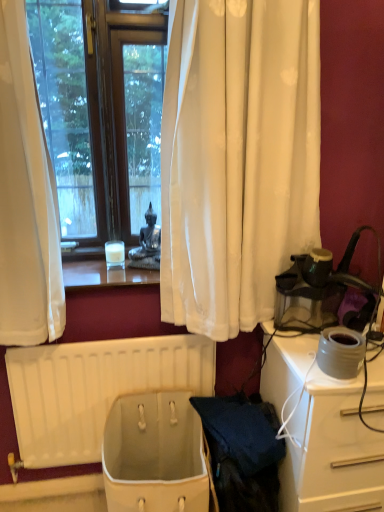
Question: Is matte gray pot at right shorter than white glossy desk at right?

Choices:
 (A) yes
 (B) no

Answer: (A)

Question: From a real-world perspective, does matte gray pot at right stand above white glossy desk at right?

Choices:
 (A) no
 (B) yes

Answer: (B)

Question: Does matte gray pot at right have a greater width compared to white glossy desk at right?

Choices:
 (A) yes
 (B) no

Answer: (B)

Question: Is matte gray pot at right further to camera compared to white glossy desk at right?

Choices:
 (A) no
 (B) yes

Answer: (B)

Question: Considering the relative sizes of matte gray pot at right and white glossy desk at right in the image provided, is matte gray pot at right taller than white glossy desk at right?

Choices:
 (A) yes
 (B) no

Answer: (B)

Question: Is translucent glass candle at center inside or outside of white fabric basket at lower center?

Choices:
 (A) inside
 (B) outside

Answer: (B)

Question: Is translucent glass candle at center taller or shorter than white fabric basket at lower center?

Choices:
 (A) tall
 (B) short

Answer: (B)

Question: In the image, is translucent glass candle at center positioned in front of or behind white fabric basket at lower center?

Choices:
 (A) behind
 (B) front

Answer: (A)

Question: Is translucent glass candle at center bigger or smaller than white fabric basket at lower center?

Choices:
 (A) small
 (B) big

Answer: (A)

Question: Considering the relative positions of white plastic radiator at lower center and translucent glass candle at center in the image provided, is white plastic radiator at lower center to the left or to the right of translucent glass candle at center?

Choices:
 (A) left
 (B) right

Answer: (A)

Question: In terms of height, does white plastic radiator at lower center look taller or shorter compared to translucent glass candle at center?

Choices:
 (A) short
 (B) tall

Answer: (B)

Question: Based on their sizes in the image, would you say white plastic radiator at lower center is bigger or smaller than translucent glass candle at center?

Choices:
 (A) big
 (B) small

Answer: (A)

Question: Is point [x=139, y=351] positioned closer to the camera than point [x=67, y=280]?

Choices:
 (A) farther
 (B) closer

Answer: (B)

Question: Is point (340, 330) positioned closer to the camera than point (185, 416)?

Choices:
 (A) farther
 (B) closer

Answer: (B)

Question: Considering the relative positions of matte gray pot at right and white fabric basket at lower center in the image provided, is matte gray pot at right to the left or to the right of white fabric basket at lower center?

Choices:
 (A) left
 (B) right

Answer: (B)